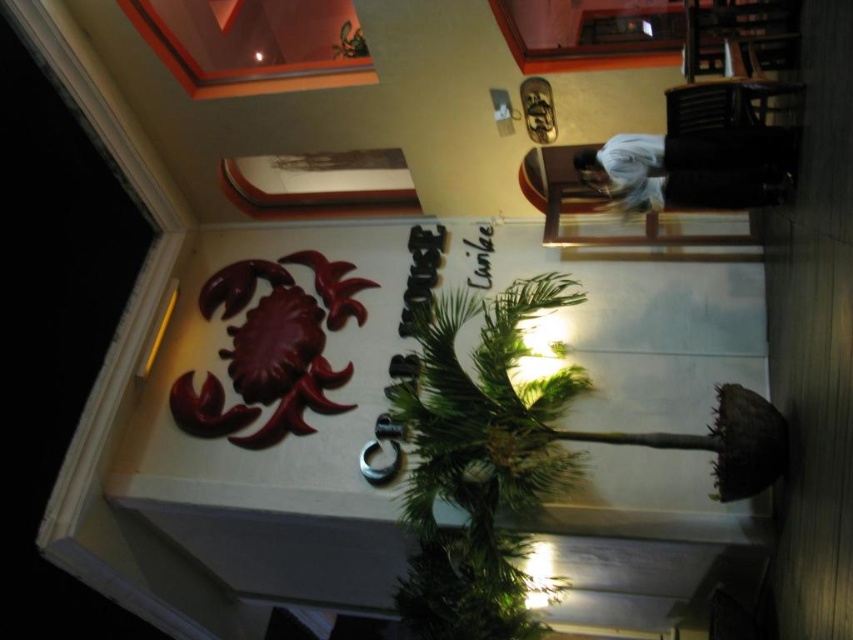
Between point (495, 451) and point (708, 163), which one is positioned behind?

The point (495, 451) is more distant.

Who is lower down, green leafy palm tree at center or white cotton shirt at upper right?

green leafy palm tree at center is below.

You are a GUI agent. You are given a task and a screenshot of the screen. Output one action in this format:
    pyautogui.click(x=<x>, y=<y>)
    Task: Click on the green leafy palm tree at center
    Image resolution: width=853 pixels, height=640 pixels.
    Given the screenshot: What is the action you would take?
    pyautogui.click(x=480, y=465)